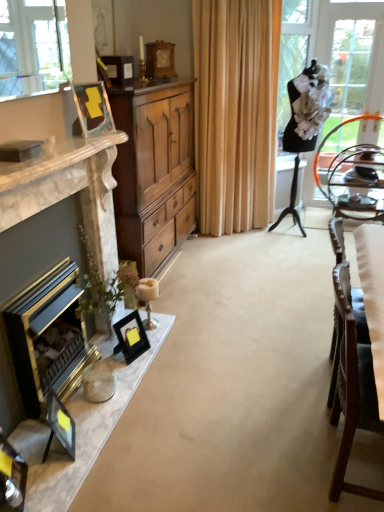
Question: Is marble fireplace at left, the second fireplace positioned from the back, facing away from wooden cabinet at center?

Choices:
 (A) yes
 (B) no

Answer: (B)

Question: From the image's perspective, is marble fireplace at left, the second fireplace positioned from the back, below wooden cabinet at center?

Choices:
 (A) no
 (B) yes

Answer: (B)

Question: Does marble fireplace at left, which appears as the 1th fireplace when viewed from the front, have a smaller size compared to wooden cabinet at center?

Choices:
 (A) yes
 (B) no

Answer: (A)

Question: Is marble fireplace at left, which appears as the 1th fireplace when viewed from the front, wider than wooden cabinet at center?

Choices:
 (A) yes
 (B) no

Answer: (B)

Question: From a real-world perspective, does marble fireplace at left, the second fireplace positioned from the back, stand above wooden cabinet at center?

Choices:
 (A) yes
 (B) no

Answer: (B)

Question: From the image's perspective, relative to metallic silver tray at right, is beige fabric curtain at center above or below?

Choices:
 (A) below
 (B) above

Answer: (B)

Question: Considering the positions of beige fabric curtain at center and metallic silver tray at right in the image, is beige fabric curtain at center bigger or smaller than metallic silver tray at right?

Choices:
 (A) big
 (B) small

Answer: (A)

Question: Considering the relative positions of beige fabric curtain at center and metallic silver tray at right in the image provided, is beige fabric curtain at center to the left or to the right of metallic silver tray at right?

Choices:
 (A) right
 (B) left

Answer: (B)

Question: In terms of width, does beige fabric curtain at center look wider or thinner when compared to metallic silver tray at right?

Choices:
 (A) thin
 (B) wide

Answer: (A)

Question: Is white fabric chair at right wider or thinner than matte black picture frame at lower left, which is the second picture frame from bottom to top?

Choices:
 (A) wide
 (B) thin

Answer: (A)

Question: In the image, is white fabric chair at right positioned in front of or behind matte black picture frame at lower left, the 3th picture frame from the back?

Choices:
 (A) front
 (B) behind

Answer: (A)

Question: Would you say white fabric chair at right is inside or outside matte black picture frame at lower left, placed as the third picture frame when sorted from front to back?

Choices:
 (A) inside
 (B) outside

Answer: (B)

Question: In the image, is white fabric chair at right on the left side or the right side of matte black picture frame at lower left, which is the second picture frame from bottom to top?

Choices:
 (A) right
 (B) left

Answer: (A)

Question: From a real-world perspective, relative to metallic silver tray at right, is matte black picture frame at lower left, the first picture frame positioned from the front, vertically above or below?

Choices:
 (A) below
 (B) above

Answer: (A)

Question: From the image's perspective, relative to metallic silver tray at right, is matte black picture frame at lower left, the 5th picture frame viewed from the back, above or below?

Choices:
 (A) below
 (B) above

Answer: (A)